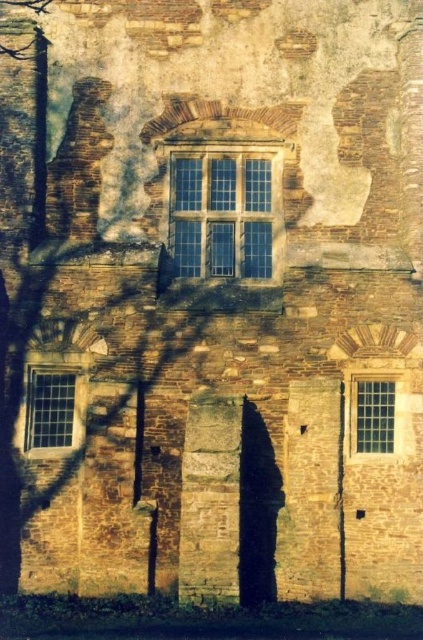
Question: Which is nearer to the clear glass window at lower right?

Choices:
 (A) clear glass window at lower left
 (B) clear glass window at center

Answer: (B)

Question: Is clear glass window at center below clear glass window at lower right?

Choices:
 (A) yes
 (B) no

Answer: (B)

Question: Among these objects, which one is farthest from the camera?

Choices:
 (A) clear glass window at lower right
 (B) clear glass window at lower left

Answer: (B)

Question: Does clear glass window at center have a larger size compared to clear glass window at lower left?

Choices:
 (A) no
 (B) yes

Answer: (B)

Question: Based on their relative distances, which object is farther from the clear glass window at center?

Choices:
 (A) clear glass window at lower left
 (B) clear glass window at lower right

Answer: (A)

Question: Can you confirm if clear glass window at lower left is thinner than clear glass window at lower right?

Choices:
 (A) yes
 (B) no

Answer: (A)